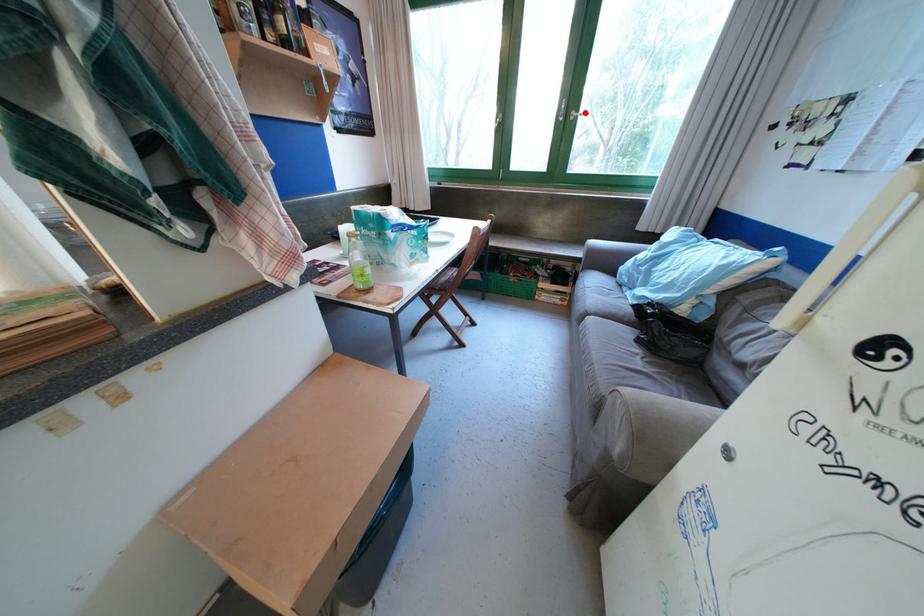
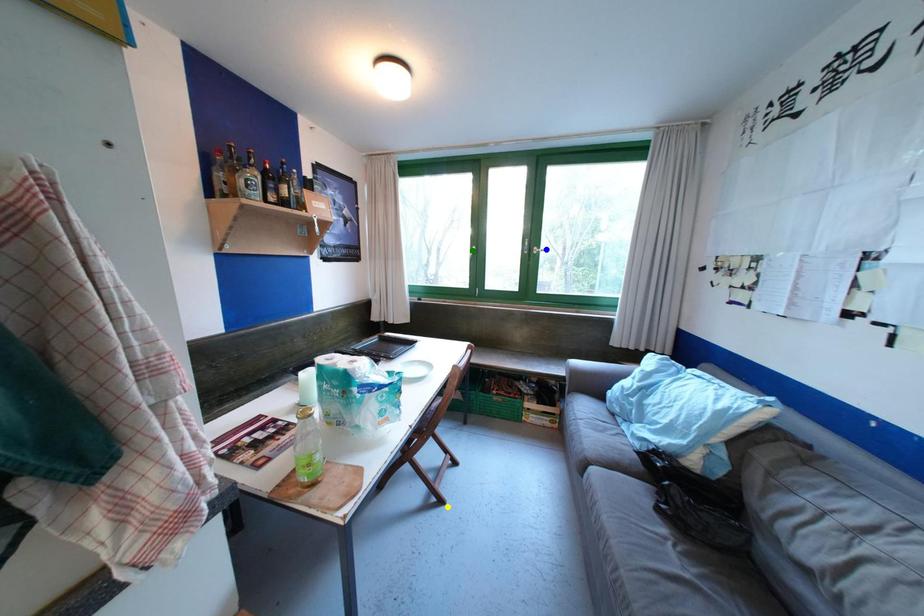
Question: I am providing you with two images of the same scene from different viewpoints. A red point is marked on the first image. You are given multiple points on the second image. Which point in image 2 represents the same 3d spot as the red point in image 1?

Choices:
 (A) yellow point
 (B) blue point
 (C) green point

Answer: (B)